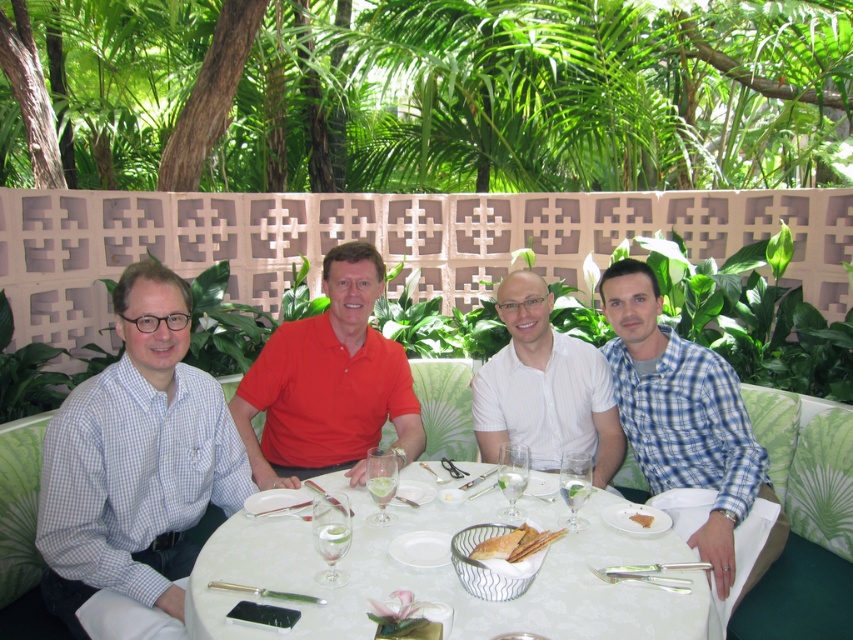
You are sitting at the white glossy table at center and want to hand a napkin to the person wearing the blue checkered shirt at left. Which direction should you move to reach them?

The white glossy table at center is behind the blue checkered shirt at left, so you should move forward to reach them.

You are a photographer standing at the edge of the tropical garden where the white glossy table at center is located. You want to capture a photo that includes the table and the four people sitting around it. Based on the coordinates provided, where should you position yourself relative to the table to ensure everyone is in frame?

The white glossy table at center is positioned at coordinates point [444,577]. To capture everyone in frame, position yourself at a central angle that allows the camera to encompass all four sides of the table, ensuring the table is centered in the shot while capturing the individuals seated around it.

In the scene shown: You are a photographer trying to capture a group photo of the blue checkered shirt at left and the white glossy table at center. Which object should you focus on first if you want to ensure both are in clear focus?

The blue checkered shirt at left is much taller than the white glossy table at center, so focusing on the blue checkered shirt at left first will help ensure both are in clear focus since it is farther away.